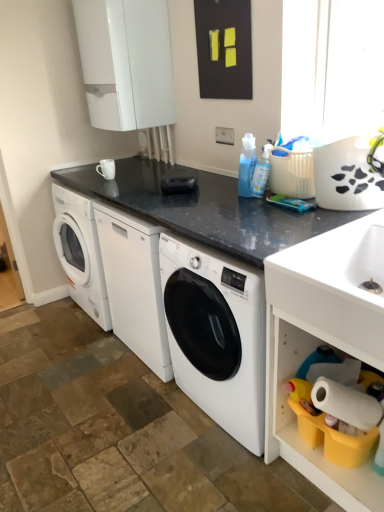
Question: Considering the relative positions of white glossy sink at lower right and white plastic shelf at lower right in the image provided, is white glossy sink at lower right to the right of white plastic shelf at lower right from the viewer's perspective?

Choices:
 (A) yes
 (B) no

Answer: (B)

Question: Considering the relative sizes of white glossy sink at lower right and white plastic shelf at lower right in the image provided, is white glossy sink at lower right thinner than white plastic shelf at lower right?

Choices:
 (A) yes
 (B) no

Answer: (A)

Question: Is white plastic shelf at lower right at the back of white glossy sink at lower right?

Choices:
 (A) yes
 (B) no

Answer: (A)

Question: From a real-world perspective, is white glossy sink at lower right located beneath white plastic shelf at lower right?

Choices:
 (A) no
 (B) yes

Answer: (A)

Question: Can you confirm if white glossy sink at lower right is positioned to the left of white plastic shelf at lower right?

Choices:
 (A) no
 (B) yes

Answer: (B)

Question: Considering the relative sizes of white glossy sink at lower right and white plastic shelf at lower right in the image provided, is white glossy sink at lower right shorter than white plastic shelf at lower right?

Choices:
 (A) yes
 (B) no

Answer: (A)

Question: From the image's perspective, is blue glossy bottle at center located beneath white plastic shelf at lower right?

Choices:
 (A) yes
 (B) no

Answer: (B)

Question: Is blue glossy bottle at center positioned behind white plastic shelf at lower right?

Choices:
 (A) no
 (B) yes

Answer: (B)

Question: From a real-world perspective, is blue glossy bottle at center on top of white plastic shelf at lower right?

Choices:
 (A) no
 (B) yes

Answer: (B)

Question: Does blue glossy bottle at center lie in front of white plastic shelf at lower right?

Choices:
 (A) no
 (B) yes

Answer: (A)

Question: Could you tell me if blue glossy bottle at center is turned towards white plastic shelf at lower right?

Choices:
 (A) no
 (B) yes

Answer: (A)

Question: From a real-world perspective, is blue glossy bottle at center positioned under white plastic shelf at lower right based on gravity?

Choices:
 (A) no
 (B) yes

Answer: (A)

Question: Is white plastic shelf at lower right at the right side of blue glossy bottle at center?

Choices:
 (A) yes
 (B) no

Answer: (A)